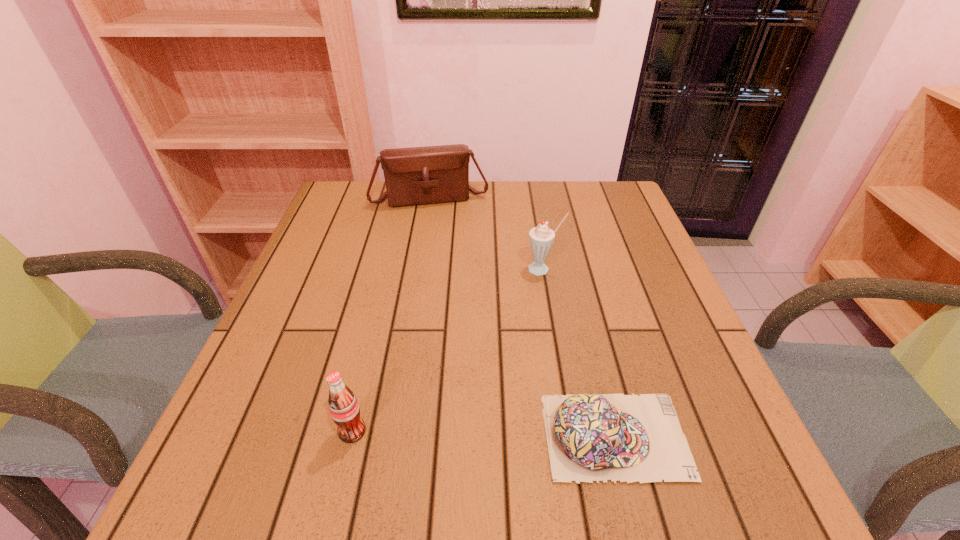
At what (x,y) coordinates should I click in order to perform the action: click on vacant area that lies between the cap and the shoulder bag. Please return your answer as a coordinate pair (x, y). Looking at the image, I should click on (522, 317).

Find the location of `vacant region between the milkshake and the shoulder bag`. vacant region between the milkshake and the shoulder bag is located at coordinates (487, 233).

At what (x,y) coordinates should I click in order to perform the action: click on vacant area that lies between the shortest object and the milkshake. Please return your answer as a coordinate pair (x, y). This screenshot has height=540, width=960. Looking at the image, I should click on (579, 353).

Locate an element on the screen. vacant area between the milkshake and the shoulder bag is located at coordinates (487, 233).

Find the location of a particular element. This screenshot has width=960, height=540. object that is the second closest to the cap is located at coordinates (541, 238).

Choose which object is the nearest neighbor to the soda. Please provide its 2D coordinates. Your answer should be formatted as a tuple, i.e. [(x, y)], where the tuple contains the x and y coordinates of a point satisfying the conditions above.

[(591, 437)]

Where is `free point that satisfies the following two spatial constraints: 1. on the front side of the soda; 2. on the front, side, and top of the cap`? The image size is (960, 540). free point that satisfies the following two spatial constraints: 1. on the front side of the soda; 2. on the front, side, and top of the cap is located at coordinates (351, 436).

You are a GUI agent. You are given a task and a screenshot of the screen. Output one action in this format:
    pyautogui.click(x=<x>, y=<y>)
    Task: Click on the free space that satisfies the following two spatial constraints: 1. on the front side of the shoulder bag; 2. on the right side of the milkshake
    
    Given the screenshot: What is the action you would take?
    pyautogui.click(x=419, y=269)